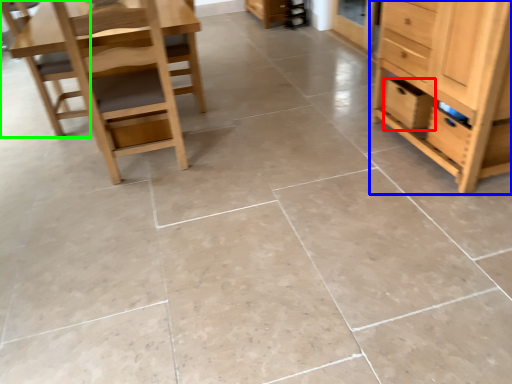
Question: Which object is the closest to the drawer (highlighted by a red box)? Choose among these: chest of drawers (highlighted by a blue box) or chair (highlighted by a green box).

Choices:
 (A) chest of drawers
 (B) chair

Answer: (A)